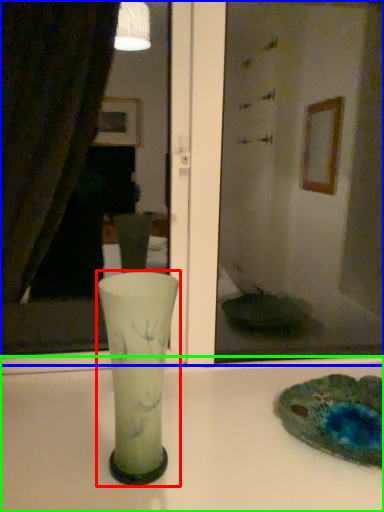
Question: Estimate the real-world distances between objects in this image. Which object is closer to vase (highlighted by a red box), mirror (highlighted by a blue box) or counter top (highlighted by a green box)?

Choices:
 (A) mirror
 (B) counter top

Answer: (B)